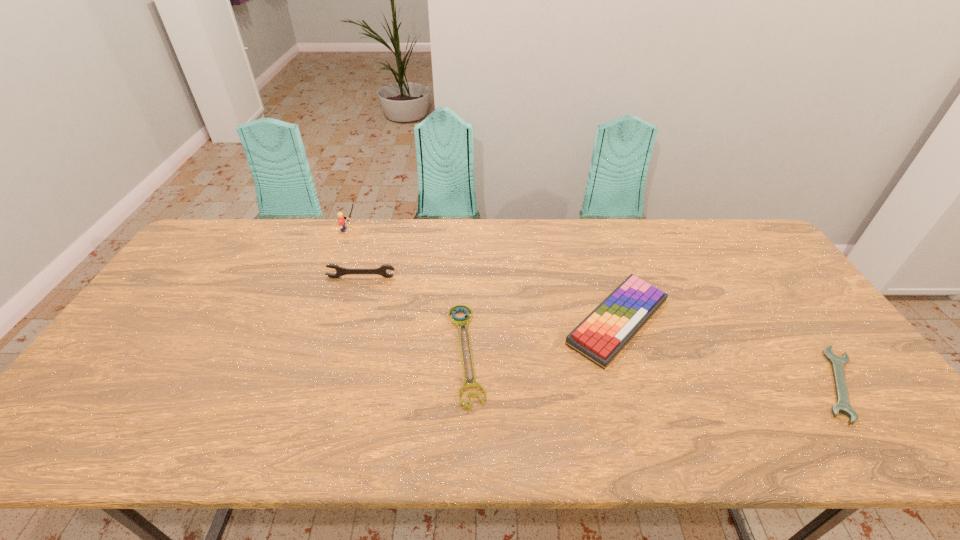
Identify the location of free space located 0.190m on the left of the fourth object from left to right. This screenshot has height=540, width=960. (493, 321).

Where is `free space located on the left of the second wrench from right to left`? free space located on the left of the second wrench from right to left is located at coordinates (370, 353).

The height and width of the screenshot is (540, 960). I want to click on vacant space positioned 0.390m on the left of the rightmost wrench, so click(653, 383).

Identify the location of object that is at the far edge. (341, 219).

Where is `object located in the near edge section of the desktop`? This screenshot has width=960, height=540. object located in the near edge section of the desktop is located at coordinates (837, 362).

You are a GUI agent. You are given a task and a screenshot of the screen. Output one action in this format:
    pyautogui.click(x=<x>, y=<y>)
    Task: Click on the object situated at the right edge
    
    Given the screenshot: What is the action you would take?
    pyautogui.click(x=837, y=362)

Where is `object at the near right corner`? The width and height of the screenshot is (960, 540). object at the near right corner is located at coordinates coord(837,362).

Identify the location of free space at the far edge of the desktop. Image resolution: width=960 pixels, height=540 pixels. (253, 244).

In the image, there is a desktop. Identify the location of vacant space at the near edge. (443, 426).

At what (x,y) coordinates should I click in order to perform the action: click on vacant area at the left edge of the desktop. Please return your answer as a coordinate pair (x, y). This screenshot has height=540, width=960. Looking at the image, I should click on (125, 338).